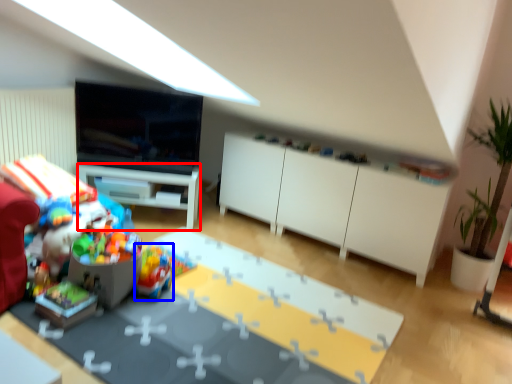
Question: Which object is further to the camera taking this photo, desk (highlighted by a red box) or toy (highlighted by a blue box)?

Choices:
 (A) desk
 (B) toy

Answer: (A)